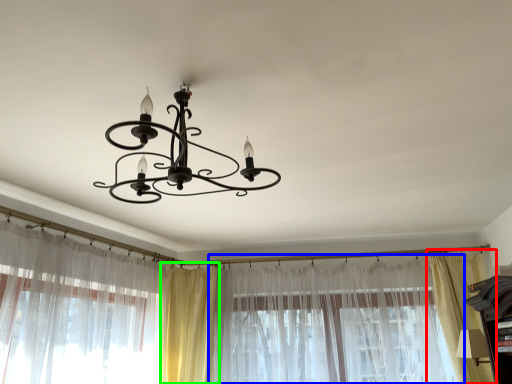
Question: Estimate the real-world distances between objects in this image. Which object is farther from curtain (highlighted by a red box), curtain (highlighted by a blue box) or curtain (highlighted by a green box)?

Choices:
 (A) curtain
 (B) curtain

Answer: (B)